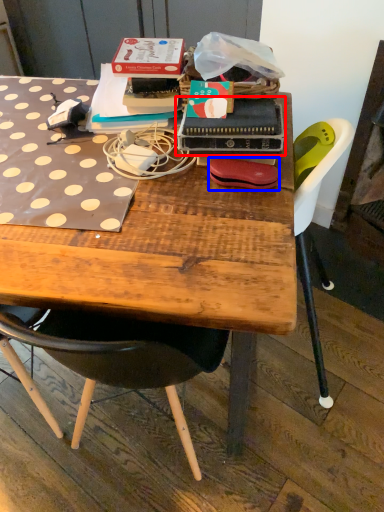
Question: Among these objects, which one is nearest to the camera, paperback book (highlighted by a red box) or handbag (highlighted by a blue box)?

Choices:
 (A) paperback book
 (B) handbag

Answer: (A)